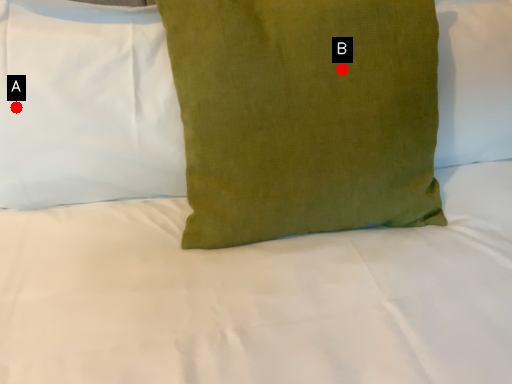
Question: Two points are circled on the image, labeled by A and B beside each circle. Which point appears closest to the camera in this image?

Choices:
 (A) A is closer
 (B) B is closer

Answer: (B)